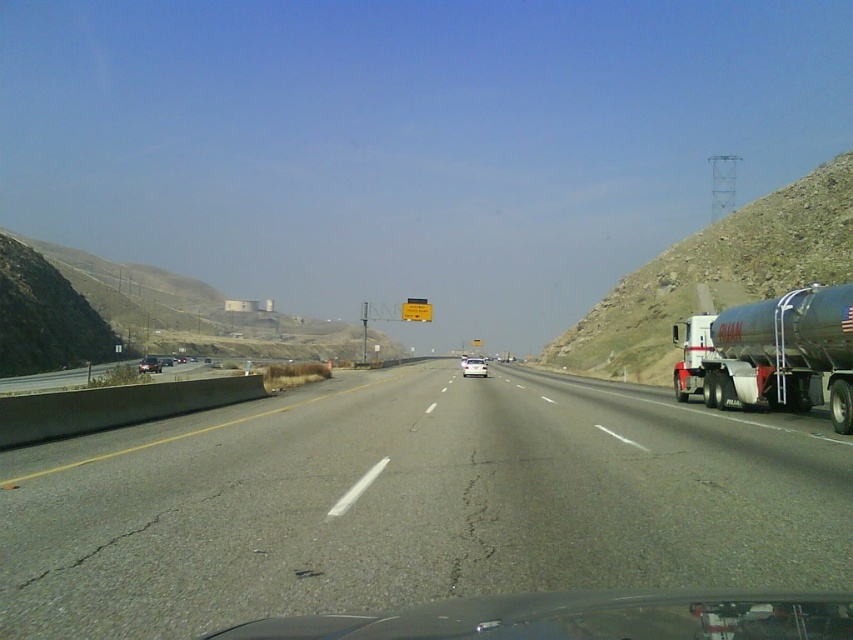
You are a delivery driver who needs to pass through the highway shown in the image. You have a trailer attached to your truck that is 10 meters long. Can the trailer fit on the asphalt road at center without overlapping the metallic silver tanker at right?

The asphalt road at center is bigger than the metallic silver tanker at right, so the trailer can fit on the asphalt road at center without overlapping the metallic silver tanker at right.

You are driving a car that is 1.5 meters tall and want to pass under the metallic silver tanker at right while staying on the asphalt road at center. Can your car safely pass under the tanker without hitting it?

The asphalt road at center has a lesser height compared to metallic silver tanker at right, meaning the road is lower than the tanker. Since your car is 1.5 meters tall, it should be able to pass safely under the metallic silver tanker at right as the road is lower and there is no obstruction from the tanker above the road.

You are driving a car and see the transparent glass windshield at lower center and the white matte van at center. Which object is shorter in height?

The transparent glass windshield at lower center is shorter in height compared to the white matte van at center.